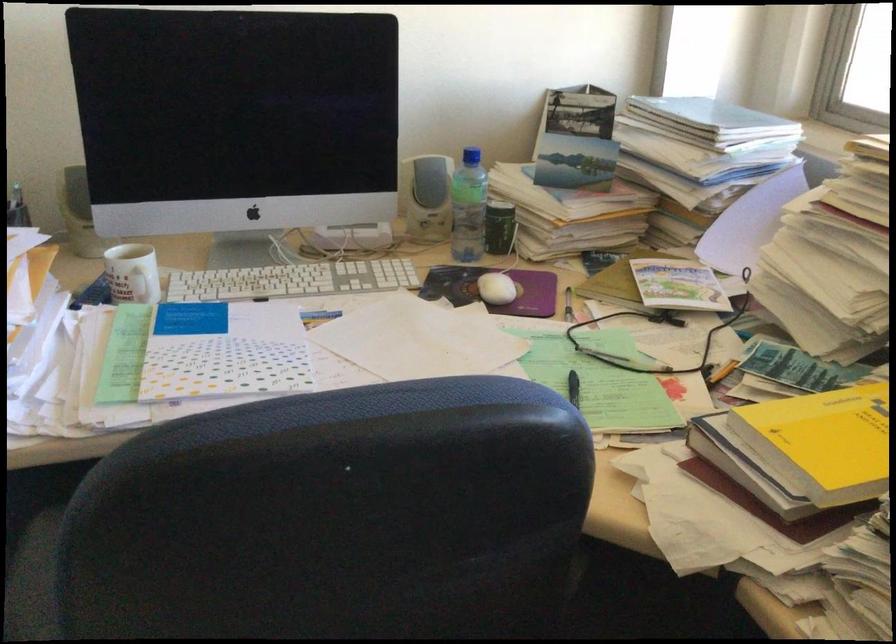
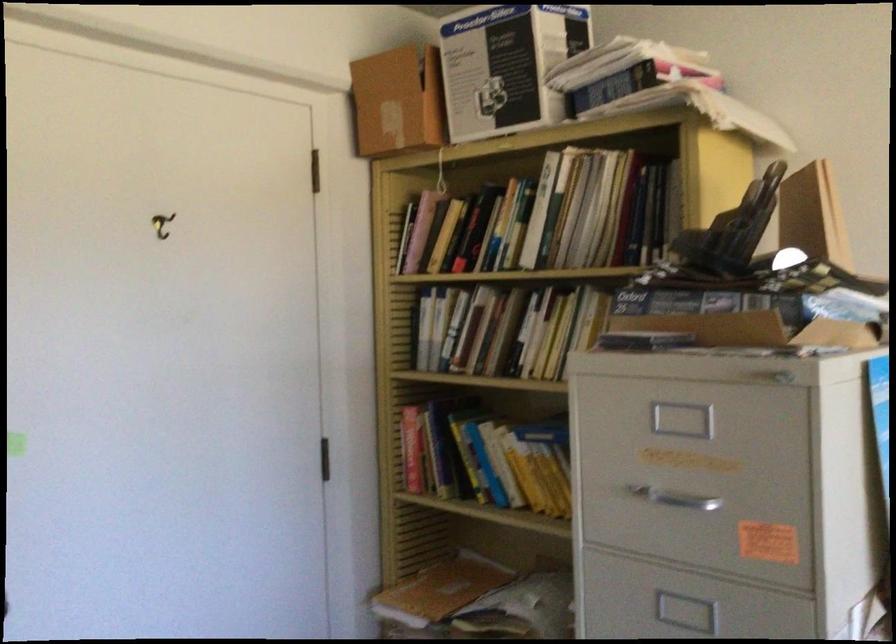
Question: The first image is from the beginning of the video and the second image is from the end. How did the camera likely rotate when shooting the video?

Choices:
 (A) Left
 (B) Right
 (C) Up
 (D) Down

Answer: (A)